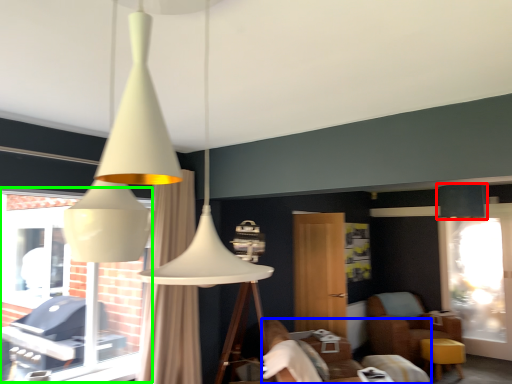
Question: Considering the real-world distances, which object is farthest from lamp (highlighted by a red box)? furniture (highlighted by a blue box) or bay window (highlighted by a green box)?

Choices:
 (A) furniture
 (B) bay window

Answer: (B)